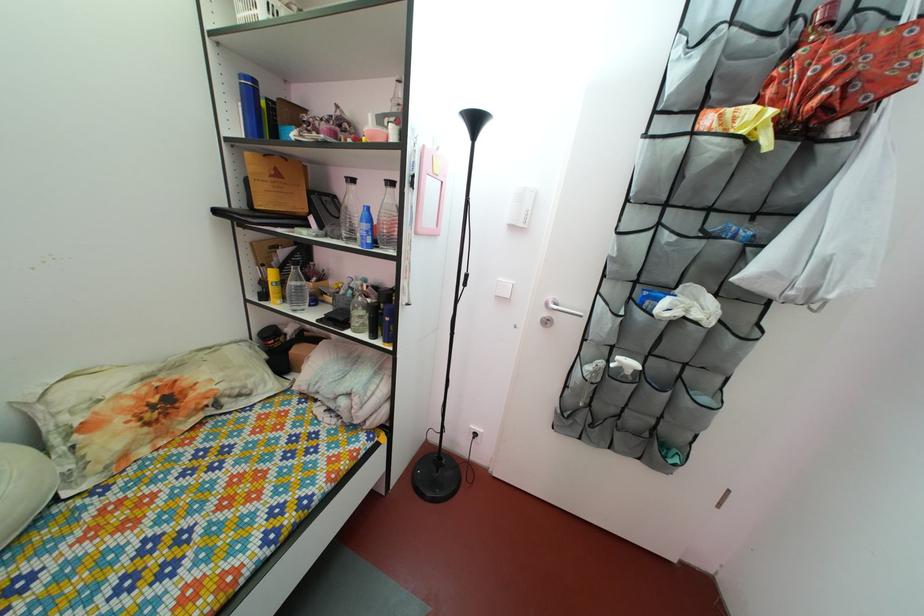
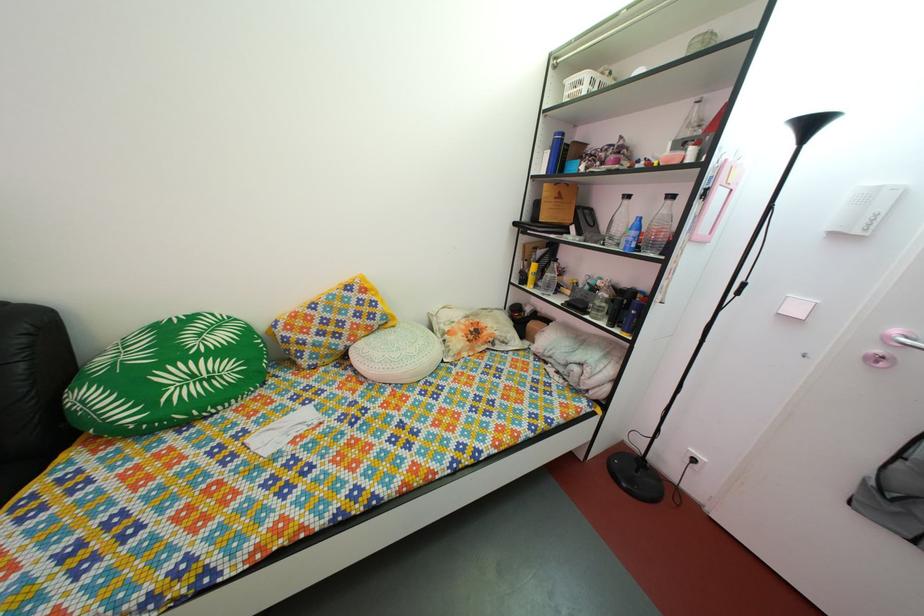
Locate, in the second image, the point that corresponds to point (282, 299) in the first image.

(540, 286)